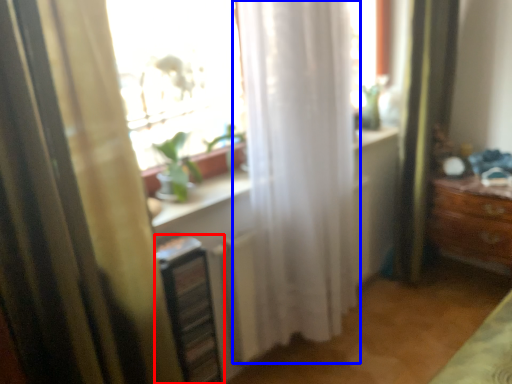
Question: Which object is closer to the camera taking this photo, shelf (highlighted by a red box) or curtain (highlighted by a blue box)?

Choices:
 (A) shelf
 (B) curtain

Answer: (B)